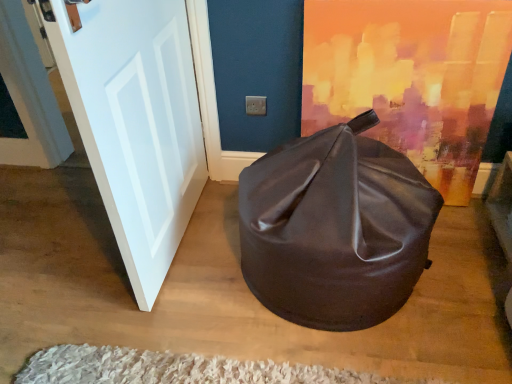
Question: Is white shaggy rug at lower center further to camera compared to white glossy door at left?

Choices:
 (A) yes
 (B) no

Answer: (A)

Question: Is white shaggy rug at lower center to the left of white glossy door at left from the viewer's perspective?

Choices:
 (A) yes
 (B) no

Answer: (B)

Question: Does white shaggy rug at lower center have a greater height compared to white glossy door at left?

Choices:
 (A) no
 (B) yes

Answer: (A)

Question: Could you tell me if white shaggy rug at lower center is turned towards white glossy door at left?

Choices:
 (A) no
 (B) yes

Answer: (A)

Question: From a real-world perspective, is white shaggy rug at lower center beneath white glossy door at left?

Choices:
 (A) no
 (B) yes

Answer: (B)

Question: From the image's perspective, relative to shiny brown bean bag at center, is white shaggy rug at lower center above or below?

Choices:
 (A) below
 (B) above

Answer: (A)

Question: In terms of size, does white shaggy rug at lower center appear bigger or smaller than shiny brown bean bag at center?

Choices:
 (A) big
 (B) small

Answer: (B)

Question: From a real-world perspective, relative to shiny brown bean bag at center, is white shaggy rug at lower center vertically above or below?

Choices:
 (A) above
 (B) below

Answer: (B)

Question: Is point (32, 382) positioned closer to the camera than point (393, 183)?

Choices:
 (A) closer
 (B) farther

Answer: (A)

Question: Looking at their shapes, would you say shiny brown bean bag at center is wider or thinner than white shaggy rug at lower center?

Choices:
 (A) thin
 (B) wide

Answer: (A)

Question: From a real-world perspective, is shiny brown bean bag at center above or below white shaggy rug at lower center?

Choices:
 (A) below
 (B) above

Answer: (B)

Question: Is shiny brown bean bag at center bigger or smaller than white shaggy rug at lower center?

Choices:
 (A) big
 (B) small

Answer: (A)

Question: From the image's perspective, is shiny brown bean bag at center above or below white shaggy rug at lower center?

Choices:
 (A) below
 (B) above

Answer: (B)

Question: From the image's perspective, is white shaggy rug at lower center above or below white glossy door at left?

Choices:
 (A) below
 (B) above

Answer: (A)

Question: Is white shaggy rug at lower center situated inside white glossy door at left or outside?

Choices:
 (A) outside
 (B) inside

Answer: (A)